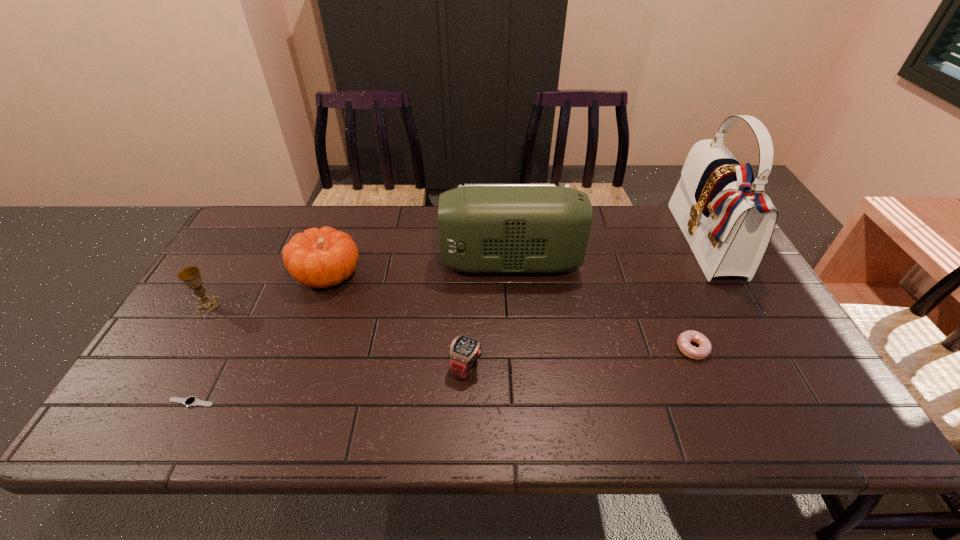
Where is `vacant region between the right watch and the sixth tallest object`? vacant region between the right watch and the sixth tallest object is located at coordinates (580, 357).

The width and height of the screenshot is (960, 540). I want to click on vacant area between the pumpkin and the sixth tallest object, so click(x=510, y=312).

The width and height of the screenshot is (960, 540). I want to click on free space between the sixth object from left to right and the radio_receiver, so click(602, 306).

Identify which object is located as the sixth nearest to the sixth object from left to right. Please provide its 2D coordinates. Your answer should be formatted as a tuple, i.e. [(x, y)], where the tuple contains the x and y coordinates of a point satisfying the conditions above.

[(190, 276)]

Choose which object is the nearest neighbor to the taller watch. Please provide its 2D coordinates. Your answer should be formatted as a tuple, i.e. [(x, y)], where the tuple contains the x and y coordinates of a point satisfying the conditions above.

[(483, 228)]

The height and width of the screenshot is (540, 960). I want to click on vacant point that satisfies the following two spatial constraints: 1. on the front-facing side of the rightmost object; 2. on the front side of the taller watch, so (x=777, y=366).

Where is `vacant space that satisfies the following two spatial constraints: 1. on the back side of the nearer watch; 2. on the left side of the pumpkin`? This screenshot has height=540, width=960. vacant space that satisfies the following two spatial constraints: 1. on the back side of the nearer watch; 2. on the left side of the pumpkin is located at coordinates (258, 274).

Where is `free location that satisfies the following two spatial constraints: 1. on the back side of the pumpkin; 2. on the right side of the nearest object`? free location that satisfies the following two spatial constraints: 1. on the back side of the pumpkin; 2. on the right side of the nearest object is located at coordinates (258, 274).

Where is `free location that satisfies the following two spatial constraints: 1. on the back side of the taller watch; 2. on the right side of the shortest object`? The width and height of the screenshot is (960, 540). free location that satisfies the following two spatial constraints: 1. on the back side of the taller watch; 2. on the right side of the shortest object is located at coordinates (210, 366).